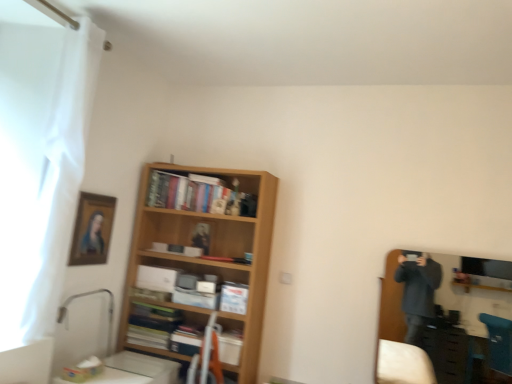
Image resolution: width=512 pixels, height=384 pixels. What do you see at coordinates (209, 253) in the screenshot?
I see `wooden bookshelf at center` at bounding box center [209, 253].

Consider the image. What is the approximate height of matte orange bookshelf at center, which is counted as the 2th book, starting from the back?

matte orange bookshelf at center, which is counted as the 2th book, starting from the back, is 51.85 centimeters tall.

How much space does wooden bookshelf at center, marked as the 2th book in a front-to-back arrangement, occupy horizontally?

9.47 inches.

Locate an element on the screen. wooden framed portrait at upper left is located at coordinates pos(92,229).

Is wooden bookshelf at center, positioned as the 1th book in back-to-front order, not within wooden entertainment center at right?

That's correct, wooden bookshelf at center, positioned as the 1th book in back-to-front order, is outside of wooden entertainment center at right.

In the scene shown: Which is closer to the camera, [232,202] or [393,258]?

Clearly, point [232,202] is more distant from the camera than point [393,258].

Who is more distant, wooden bookshelf at center, marked as the 2th book in a front-to-back arrangement, or wooden entertainment center at right?

wooden bookshelf at center, marked as the 2th book in a front-to-back arrangement, is more distant.

Can you confirm if wooden bookshelf at center, positioned as the 1th book in back-to-front order, is positioned to the left of wooden entertainment center at right?

Indeed, wooden bookshelf at center, positioned as the 1th book in back-to-front order, is positioned on the left side of wooden entertainment center at right.

Which of these two, wooden entertainment center at right or matte orange bookshelf at center, marked as the first book in a bottom-to-top arrangement, stands shorter?

matte orange bookshelf at center, marked as the first book in a bottom-to-top arrangement.

Is wooden entertainment center at right to the left of matte orange bookshelf at center, marked as the first book in a bottom-to-top arrangement, from the viewer's perspective?

No.

From the image's perspective, between wooden entertainment center at right and matte orange bookshelf at center, the second book viewed from the top, which one is located above?

wooden entertainment center at right is shown above in the image.

Between point (389, 256) and point (237, 339), which one is positioned behind?

The point (389, 256) is farther.

Which object is thinner, wooden framed portrait at upper left or white sheer curtain at left?

With smaller width is wooden framed portrait at upper left.

Is white sheer curtain at left located within wooden framed portrait at upper left?

No, white sheer curtain at left is not inside wooden framed portrait at upper left.

In the image, is wooden framed portrait at upper left on the left side or the right side of white sheer curtain at left?

In the image, wooden framed portrait at upper left appears on the right side of white sheer curtain at left.

Based on the photo, which object is closer to the camera, wooden bookshelf at center, marked as the 2th book in a front-to-back arrangement, or matte orange bookshelf at center, marked as the first book in a bottom-to-top arrangement?

matte orange bookshelf at center, marked as the first book in a bottom-to-top arrangement.

From the image's perspective, who appears lower, wooden bookshelf at center, which is the second book in bottom-to-top order, or matte orange bookshelf at center, the second book viewed from the top?

matte orange bookshelf at center, the second book viewed from the top, appears lower in the image.

Is wooden bookshelf at center, positioned as the 1th book in back-to-front order, turned away from matte orange bookshelf at center, which is counted as the 2th book, starting from the back?

wooden bookshelf at center, positioned as the 1th book in back-to-front order, is not turned away from matte orange bookshelf at center, which is counted as the 2th book, starting from the back.

Based on the photo, is wooden bookshelf at center, the 1th book in the top-to-bottom sequence, wider than matte orange bookshelf at center, which is counted as the 2th book, starting from the back?

No, wooden bookshelf at center, the 1th book in the top-to-bottom sequence, is not wider than matte orange bookshelf at center, which is counted as the 2th book, starting from the back.

Which is correct: wooden framed portrait at upper left is inside wooden bookshelf at center, or outside of it?

wooden framed portrait at upper left is located beyond the bounds of wooden bookshelf at center.

From the image's perspective, which is below, wooden framed portrait at upper left or wooden bookshelf at center?

wooden bookshelf at center.

Is wooden framed portrait at upper left with wooden bookshelf at center?

No.

In the scene shown: Does matte orange bookshelf at center, marked as the first book in a bottom-to-top arrangement, turn towards wooden framed portrait at upper left?

No, matte orange bookshelf at center, marked as the first book in a bottom-to-top arrangement, is not oriented towards wooden framed portrait at upper left.

Identify the location of picture frame behind the matte orange bookshelf at center, marked as the first book in a bottom-to-top arrangement. The width and height of the screenshot is (512, 384). (92, 229).

Is matte orange bookshelf at center, the second book viewed from the top, shorter than wooden framed portrait at upper left?

No.

Can you confirm if matte orange bookshelf at center, the second book viewed from the top, is thinner than wooden framed portrait at upper left?

No.

Based on the photo, is wooden entertainment center at right outside of white sheer curtain at left?

Yes, wooden entertainment center at right is outside of white sheer curtain at left.

This screenshot has height=384, width=512. Identify the location of entertainment center located behind the white sheer curtain at left. (390, 305).

Is wooden entertainment center at right turned away from white sheer curtain at left?

No.

Does wooden entertainment center at right lie in front of white sheer curtain at left?

No, wooden entertainment center at right is further to the viewer.

The image size is (512, 384). In order to click on entertainment center located in front of the wooden bookshelf at center, positioned as the 1th book in back-to-front order in this screenshot , I will do `click(390, 305)`.

I want to click on book located below the wooden entertainment center at right (from the image's perspective), so click(x=161, y=329).

Looking at the image, which one is located closer to wooden framed portrait at upper left, wooden bookshelf at center, positioned as the 1th book in back-to-front order, or matte orange bookshelf at center, which is counted as the 2th book, starting from the back?

The object closer to wooden framed portrait at upper left is wooden bookshelf at center, positioned as the 1th book in back-to-front order.

Estimate the real-world distances between objects in this image. Which object is further from white sheer curtain at left, wooden entertainment center at right or wooden bookshelf at center, which is the second book in bottom-to-top order?

wooden entertainment center at right is positioned further to the anchor white sheer curtain at left.

Looking at this image, considering their positions, is white sheer curtain at left positioned closer to wooden framed portrait at upper left than wooden entertainment center at right?

Based on the image, white sheer curtain at left appears to be nearer to wooden framed portrait at upper left.

Based on their spatial positions, is wooden framed portrait at upper left or wooden bookshelf at center further from white sheer curtain at left?

wooden bookshelf at center is further to white sheer curtain at left.

Based on their spatial positions, is wooden bookshelf at center, marked as the 2th book in a front-to-back arrangement, or white sheer curtain at left further from wooden framed portrait at upper left?

The object further to wooden framed portrait at upper left is wooden bookshelf at center, marked as the 2th book in a front-to-back arrangement.

From the image, which object appears to be farther from white sheer curtain at left, matte orange bookshelf at center, which is counted as the 2th book, starting from the back, or wooden bookshelf at center?

The object further to white sheer curtain at left is matte orange bookshelf at center, which is counted as the 2th book, starting from the back.

Based on the photo, based on their spatial positions, is wooden framed portrait at upper left or wooden bookshelf at center, which is the second book in bottom-to-top order, further from wooden bookshelf at center?

wooden framed portrait at upper left is further to wooden bookshelf at center.

From the image, which object appears to be nearer to wooden framed portrait at upper left, wooden bookshelf at center or white sheer curtain at left?

white sheer curtain at left lies closer to wooden framed portrait at upper left than the other object.

Locate an element on the screen. The image size is (512, 384). picture frame between wooden bookshelf at center, which is the second book in bottom-to-top order, and matte orange bookshelf at center, marked as the first book in a bottom-to-top arrangement, in the up-down direction is located at coordinates (92, 229).

The image size is (512, 384). Identify the location of picture frame between white sheer curtain at left and matte orange bookshelf at center, arranged as the 1th book when viewed from the front, from top to bottom. (92, 229).

What are the coordinates of `book that lies between white sheer curtain at left and matte orange bookshelf at center, marked as the first book in a bottom-to-top arrangement, from top to bottom` in the screenshot? It's located at (198, 195).

Locate an element on the screen. picture frame between white sheer curtain at left and wooden entertainment center at right is located at coordinates (92, 229).